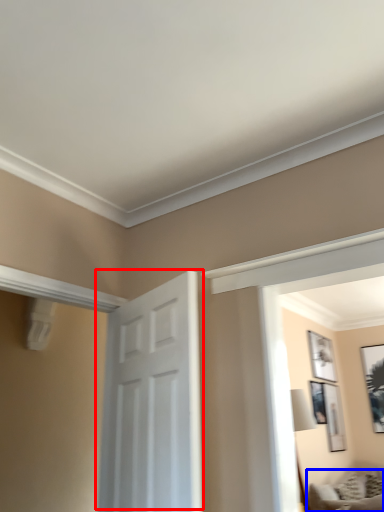
Question: Which object is further to the camera taking this photo, door (highlighted by a red box) or furniture (highlighted by a blue box)?

Choices:
 (A) door
 (B) furniture

Answer: (B)